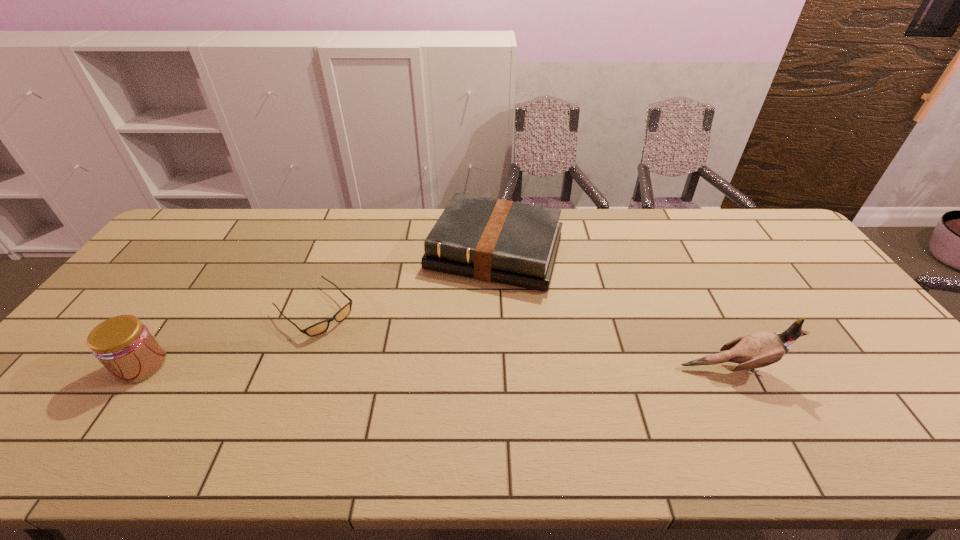
You are a GUI agent. You are given a task and a screenshot of the screen. Output one action in this format:
    pyautogui.click(x=<x>, y=<y>)
    Task: Click on the vacant area that lies between the second shortest object and the bird
    
    Given the screenshot: What is the action you would take?
    pyautogui.click(x=613, y=310)

The width and height of the screenshot is (960, 540). Find the location of `free spot between the tallest object and the third object from right to left`. free spot between the tallest object and the third object from right to left is located at coordinates (523, 339).

Locate an element on the screen. The image size is (960, 540). empty space between the hardback book and the third shortest object is located at coordinates (318, 308).

This screenshot has width=960, height=540. What are the coordinates of `free space between the second tallest object and the sunglasses` in the screenshot? It's located at (228, 338).

You are a GUI agent. You are given a task and a screenshot of the screen. Output one action in this format:
    pyautogui.click(x=<x>, y=<y>)
    Task: Click on the free area in between the third object from right to left and the second shortest object
    
    Given the screenshot: What is the action you would take?
    pyautogui.click(x=405, y=281)

At what (x,y) coordinates should I click in order to perform the action: click on empty space that is in between the hardback book and the tallest object. Please return your answer as a coordinate pair (x, y). Looking at the image, I should click on (613, 310).

The width and height of the screenshot is (960, 540). I want to click on object that can be found as the second closest to the sunglasses, so click(126, 348).

Image resolution: width=960 pixels, height=540 pixels. I want to click on object that is the third closest to the shortest object, so click(758, 350).

This screenshot has width=960, height=540. What are the coordinates of `vacant region that satisfies the following two spatial constraints: 1. on the back side of the third shortest object; 2. on the left side of the third tallest object` in the screenshot? It's located at (221, 252).

The width and height of the screenshot is (960, 540). In order to click on vacant area in the image that satisfies the following two spatial constraints: 1. on the front side of the bird; 2. at the face of the third object from right to left in this screenshot , I will do `click(293, 368)`.